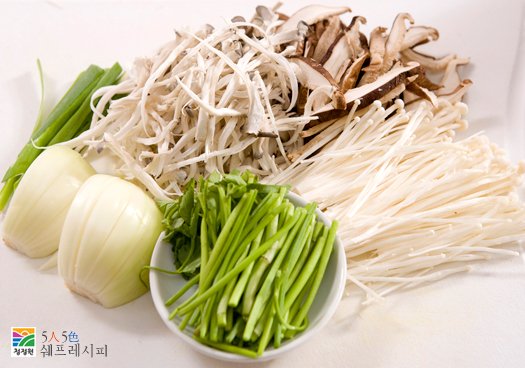
This screenshot has width=525, height=368. Find the location of `bowl`. bowl is located at coordinates (152, 286).